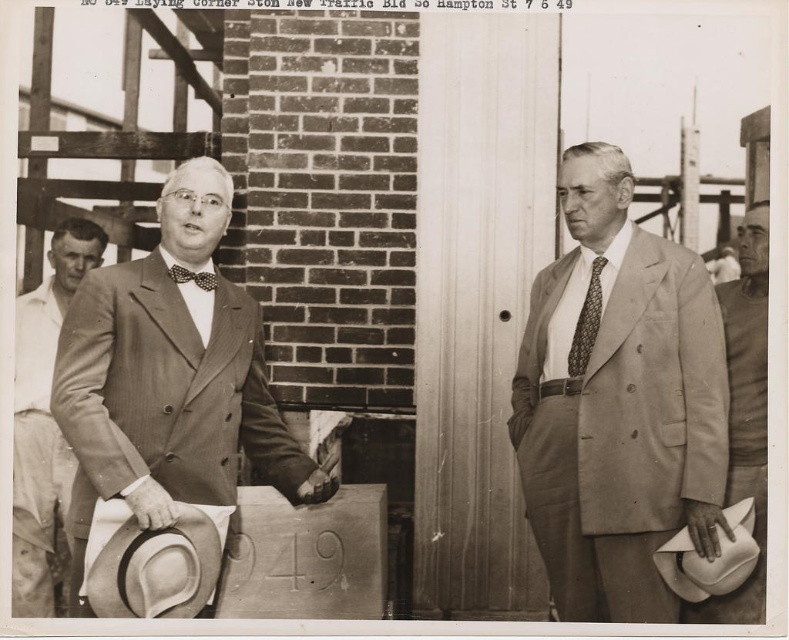
Can you confirm if smooth skin hand at lower right is smaller than smooth leather hand at center?

Yes.

Which is behind, point (713, 538) or point (301, 490)?

Point (301, 490)

The width and height of the screenshot is (789, 640). Find the location of `smooth skin hand at lower right`. smooth skin hand at lower right is located at coordinates (705, 528).

Is patterned silk tie at center shorter than polka dot silk bow tie at left?

No.

This screenshot has width=789, height=640. What do you see at coordinates (586, 321) in the screenshot? I see `patterned silk tie at center` at bounding box center [586, 321].

At what (x,y) coordinates should I click in order to perform the action: click on patterned silk tie at center. Please return your answer as a coordinate pair (x, y). Looking at the image, I should click on (586, 321).

Does light gray cotton suit at left have a larger size compared to smooth skin hand at lower right?

Yes.

Is the position of light gray cotton suit at left less distant than that of smooth skin hand at lower right?

No.

This screenshot has height=640, width=789. Describe the element at coordinates (43, 426) in the screenshot. I see `light gray cotton suit at left` at that location.

Find the location of a particular element. Image resolution: width=789 pixels, height=640 pixels. light gray cotton suit at left is located at coordinates (43, 426).